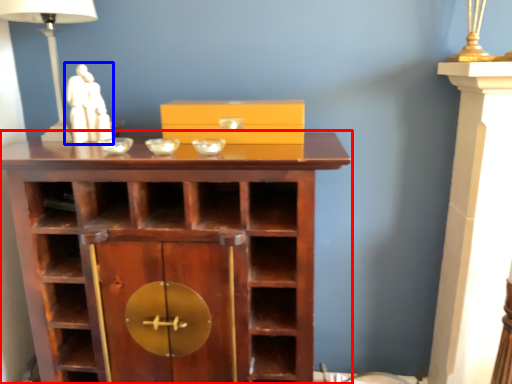
Question: Among these objects, which one is farthest to the camera, shelf (highlighted by a red box) or sculpture (highlighted by a blue box)?

Choices:
 (A) shelf
 (B) sculpture

Answer: (B)